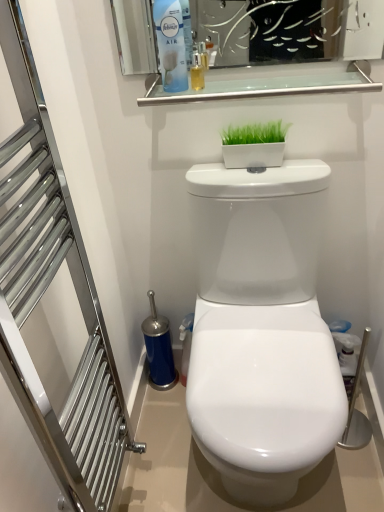
Question: Is the depth of blue plastic air freshener at upper center greater than that of brushed metal towel rack at left?

Choices:
 (A) yes
 (B) no

Answer: (A)

Question: Is blue plastic air freshener at upper center thinner than brushed metal towel rack at left?

Choices:
 (A) yes
 (B) no

Answer: (A)

Question: Does blue plastic air freshener at upper center have a greater width compared to brushed metal towel rack at left?

Choices:
 (A) yes
 (B) no

Answer: (B)

Question: From a real-world perspective, does blue plastic air freshener at upper center stand above brushed metal towel rack at left?

Choices:
 (A) no
 (B) yes

Answer: (B)

Question: Considering the relative sizes of blue plastic air freshener at upper center and brushed metal towel rack at left in the image provided, is blue plastic air freshener at upper center bigger than brushed metal towel rack at left?

Choices:
 (A) no
 (B) yes

Answer: (A)

Question: Could you tell me if blue plastic air freshener at upper center is facing brushed metal towel rack at left?

Choices:
 (A) no
 (B) yes

Answer: (A)

Question: Is clear glass shelf at upper center at the right side of brushed metal towel rack at left?

Choices:
 (A) yes
 (B) no

Answer: (A)

Question: From the image's perspective, is clear glass shelf at upper center below brushed metal towel rack at left?

Choices:
 (A) yes
 (B) no

Answer: (B)

Question: Is clear glass shelf at upper center far from brushed metal towel rack at left?

Choices:
 (A) no
 (B) yes

Answer: (A)

Question: Can you confirm if clear glass shelf at upper center is thinner than brushed metal towel rack at left?

Choices:
 (A) no
 (B) yes

Answer: (A)

Question: Is the surface of clear glass shelf at upper center in direct contact with brushed metal towel rack at left?

Choices:
 (A) yes
 (B) no

Answer: (B)

Question: Does clear glass shelf at upper center appear on the left side of brushed metal towel rack at left?

Choices:
 (A) yes
 (B) no

Answer: (B)

Question: Considering the relative positions of blue plastic air freshener at upper center and white glossy rectangular planter at upper center in the image provided, is blue plastic air freshener at upper center to the right of white glossy rectangular planter at upper center from the viewer's perspective?

Choices:
 (A) yes
 (B) no

Answer: (B)